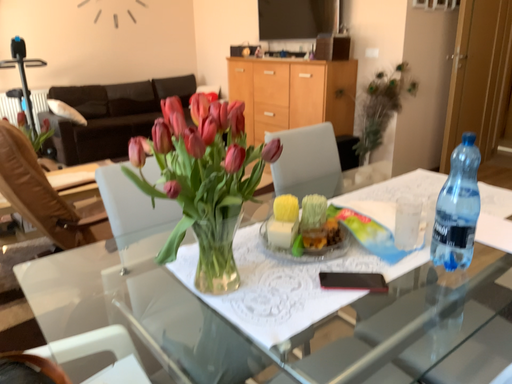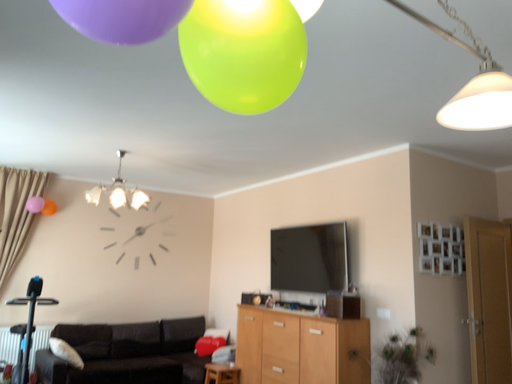
Question: Which way did the camera rotate in the video?

Choices:
 (A) rotated downward
 (B) rotated upward

Answer: (B)